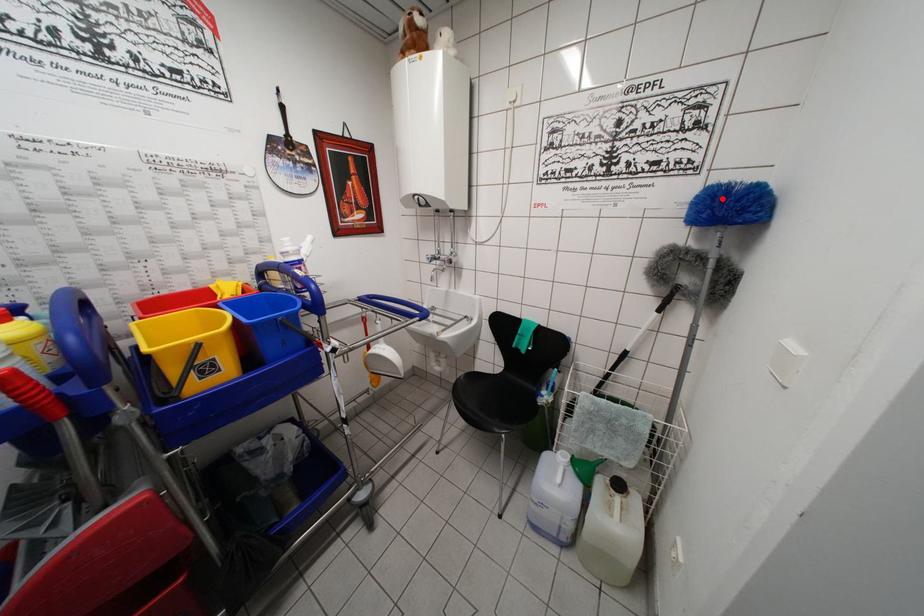
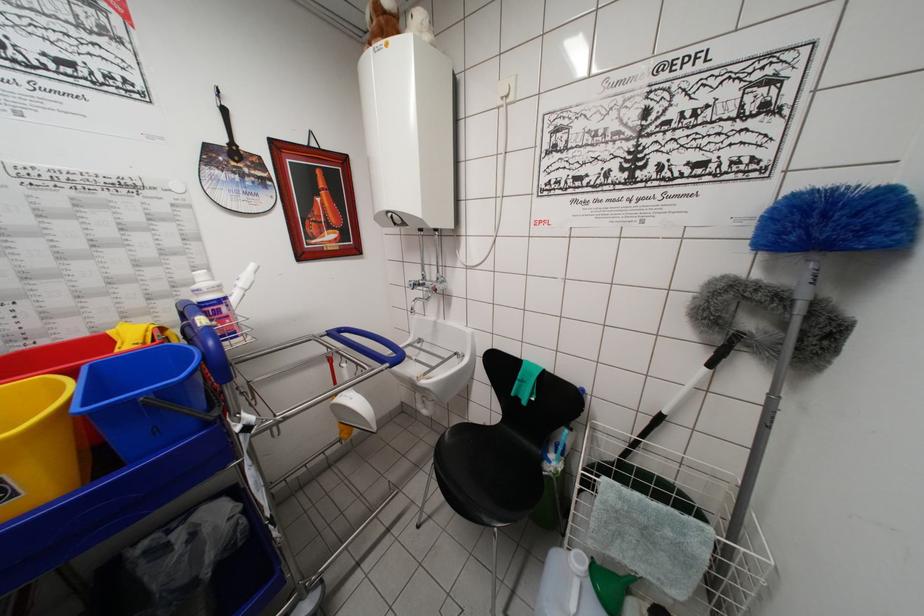
The point at the highlighted location is marked in the first image. Where is the corresponding point in the second image?

(821, 209)